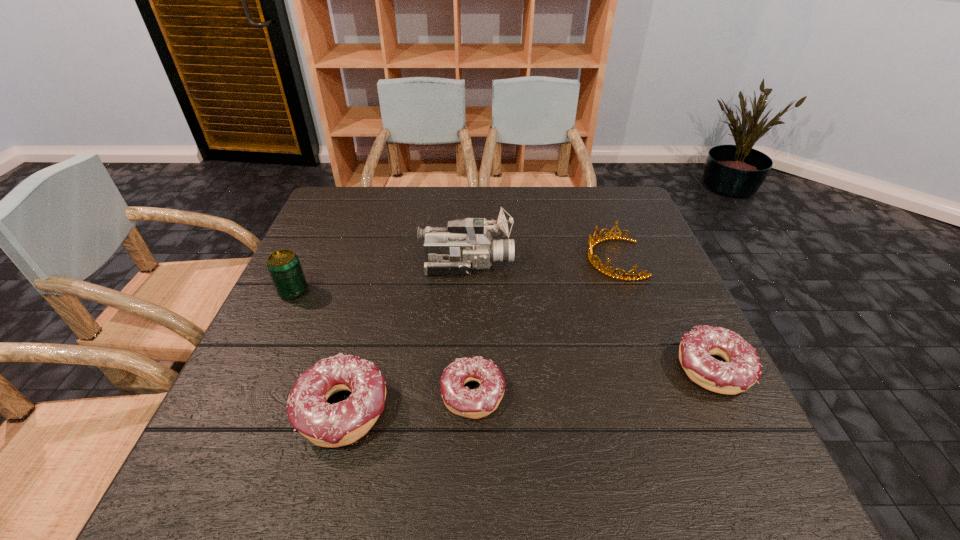
Locate an element on the screen. The width and height of the screenshot is (960, 540). spot to insert another doughnut for uniform distribution is located at coordinates (596, 381).